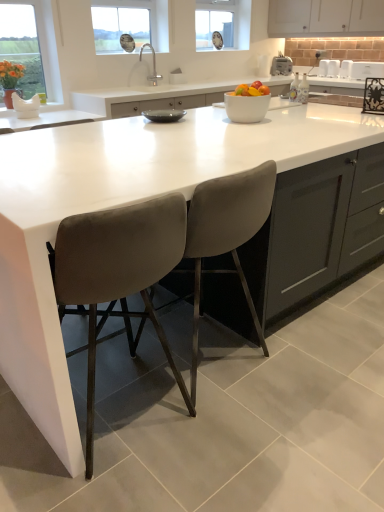
Question: Considering the relative sizes of white matte cabinet at upper center and matte glass window at upper left, the second window screen positioned from the right, in the image provided, is white matte cabinet at upper center wider than matte glass window at upper left, the second window screen positioned from the right,?

Choices:
 (A) yes
 (B) no

Answer: (A)

Question: Does white matte cabinet at upper center lie in front of matte glass window at upper left, which ranks as the 1th window screen in bottom-to-top order?

Choices:
 (A) yes
 (B) no

Answer: (B)

Question: Does white matte cabinet at upper center have a larger size compared to matte glass window at upper left, the second window screen positioned from the right?

Choices:
 (A) no
 (B) yes

Answer: (B)

Question: From a real-world perspective, is white matte cabinet at upper center on top of matte glass window at upper left, the 1th window screen viewed from the left?

Choices:
 (A) yes
 (B) no

Answer: (A)

Question: Is white matte cabinet at upper center facing away from matte glass window at upper left, the second window screen positioned from the right?

Choices:
 (A) yes
 (B) no

Answer: (B)

Question: Is matte glass window at upper left, which ranks as the 1th window screen in bottom-to-top order, taller or shorter than white plastic toaster at upper center, arranged as the 1th appliance when viewed from the left?

Choices:
 (A) tall
 (B) short

Answer: (A)

Question: Is matte glass window at upper left, the second window screen positioned from the right, bigger or smaller than white plastic toaster at upper center, positioned as the third appliance in right-to-left order?

Choices:
 (A) small
 (B) big

Answer: (B)

Question: From a real-world perspective, is matte glass window at upper left, which ranks as the 1th window screen in bottom-to-top order, physically located above or below white plastic toaster at upper center, arranged as the 1th appliance when viewed from the left?

Choices:
 (A) below
 (B) above

Answer: (B)

Question: Relative to white plastic toaster at upper center, positioned as the third appliance in right-to-left order, is matte glass window at upper left, marked as the first window screen in a front-to-back arrangement, in front or behind?

Choices:
 (A) behind
 (B) front

Answer: (B)

Question: Does point (231, 218) appear closer or farther from the camera than point (120, 10)?

Choices:
 (A) closer
 (B) farther

Answer: (A)

Question: From the image's perspective, is velvet grey chair at center, which is the 2th chair in left-to-right order, positioned above or below clear glass window at upper center?

Choices:
 (A) above
 (B) below

Answer: (B)

Question: Considering the positions of velvet grey chair at center, placed as the first chair when sorted from right to left, and clear glass window at upper center in the image, is velvet grey chair at center, placed as the first chair when sorted from right to left, bigger or smaller than clear glass window at upper center?

Choices:
 (A) big
 (B) small

Answer: (A)

Question: From their relative heights in the image, would you say velvet grey chair at center, placed as the first chair when sorted from right to left, is taller or shorter than clear glass window at upper center?

Choices:
 (A) short
 (B) tall

Answer: (B)

Question: Considering the positions of chrome metallic faucet at upper center and clear glass clock at upper center, the second window screen in the bottom-to-top sequence, in the image, is chrome metallic faucet at upper center taller or shorter than clear glass clock at upper center, the second window screen in the bottom-to-top sequence,?

Choices:
 (A) tall
 (B) short

Answer: (B)

Question: From the image's perspective, relative to clear glass clock at upper center, acting as the 1th window screen starting from the top, is chrome metallic faucet at upper center above or below?

Choices:
 (A) below
 (B) above

Answer: (A)